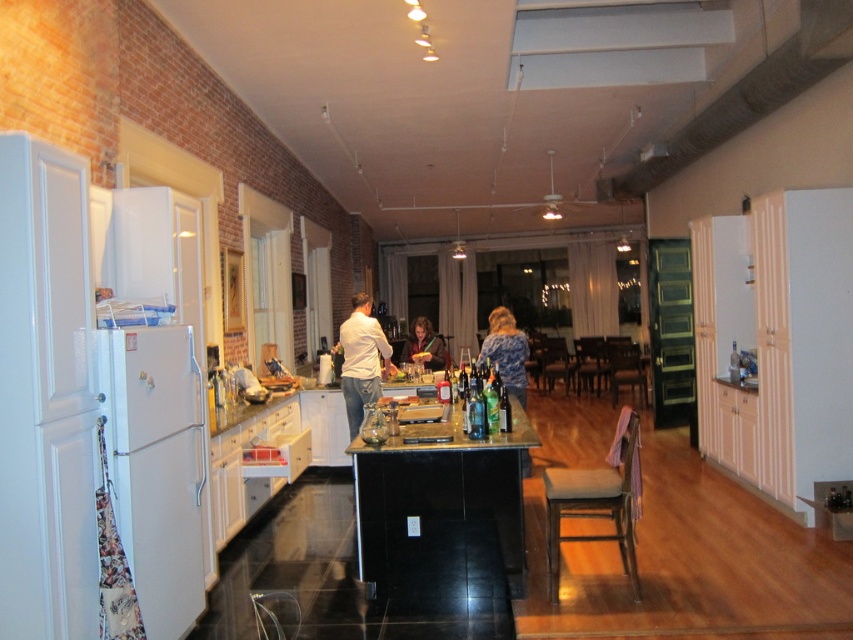
Question: Where is metallic gray ductwork at upper right located in relation to matte brown hair at center in the image?

Choices:
 (A) below
 (B) above

Answer: (B)

Question: Estimate the real-world distances between objects in this image. Which object is closer to the blue textured sweater at center?

Choices:
 (A) metallic silver counter top at center
 (B) matte brown hair at center
 (C) white cotton shirt at center
 (D) white matte refrigerator at left

Answer: (C)

Question: Which is nearer to the brown cushioned stool at lower center?

Choices:
 (A) matte brown hair at center
 (B) metallic gray ductwork at upper right

Answer: (B)

Question: Is white cotton shirt at center wider than matte brown hair at center?

Choices:
 (A) no
 (B) yes

Answer: (B)

Question: Is white matte refrigerator at left further to the viewer compared to white cotton shirt at center?

Choices:
 (A) yes
 (B) no

Answer: (B)

Question: Which object is positioned farthest from the white cotton shirt at center?

Choices:
 (A) metallic silver counter top at center
 (B) white matte refrigerator at left

Answer: (B)